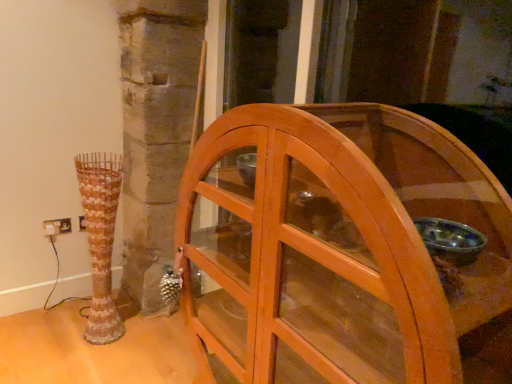
Where is `blank space to the left of rustic ceramic vase at left`? The width and height of the screenshot is (512, 384). blank space to the left of rustic ceramic vase at left is located at coordinates (63, 335).